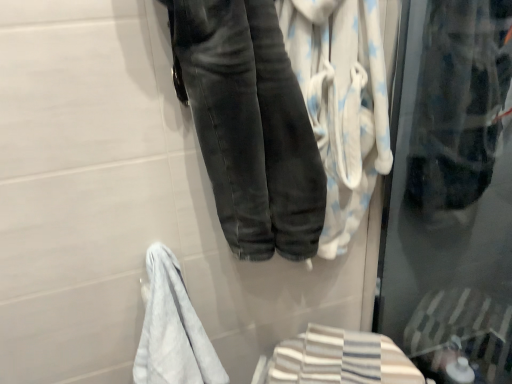
Question: Does point (214, 175) appear closer or farther from the camera than point (373, 334)?

Choices:
 (A) closer
 (B) farther

Answer: (A)

Question: From a real-world perspective, is dark gray denim jeans at center above or below striped cotton bath towel at lower right, the first bath towel in the bottom-to-top sequence?

Choices:
 (A) below
 (B) above

Answer: (B)

Question: Estimate the real-world distances between objects in this image. Which object is farther from the white soft towel at lower left?

Choices:
 (A) dark gray denim jeans at center
 (B) striped cotton bath towel at lower right, the first bath towel in the bottom-to-top sequence
 (C) white soft towel at center, positioned as the 2th bath towel in bottom-to-top order
 (D) transparent plastic bag at upper right

Answer: (D)

Question: Estimate the real-world distances between objects in this image. Which object is farther from the white soft towel at lower left?

Choices:
 (A) transparent plastic bag at upper right
 (B) striped cotton bath towel at lower right, which ranks as the 2th bath towel in top-to-bottom order
 (C) dark gray denim jeans at center
 (D) white soft towel at center, positioned as the 2th bath towel in bottom-to-top order

Answer: (A)